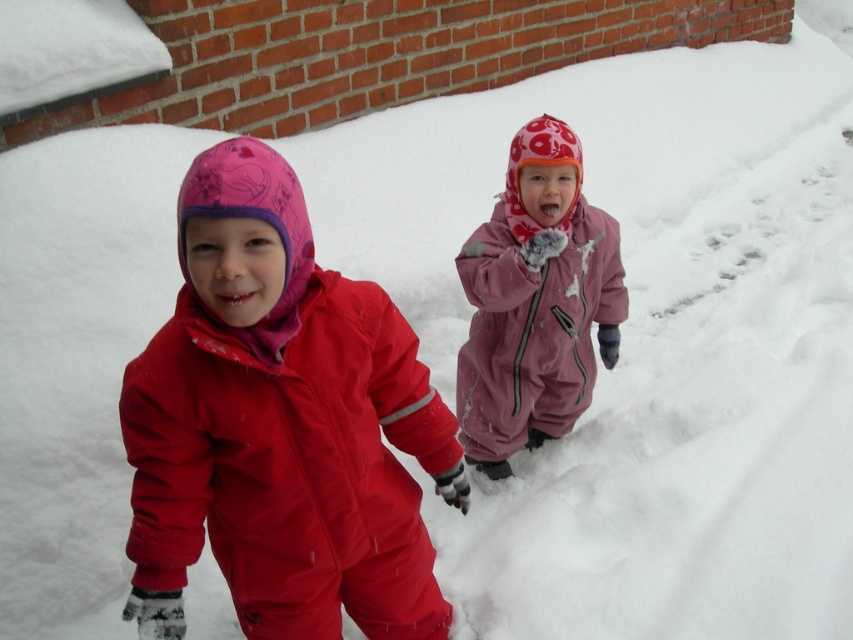
You are a photographer trying to capture both children in a single frame. Given that the matte red snowsuit at left and the matte pink snowsuit at center are visible, which child should you position closer to the center of the frame to ensure both fit comfortably without overcrowding?

The matte red snowsuit at left is wider than the matte pink snowsuit at center. To ensure both fit comfortably, position the wider matte red snowsuit at left closer to the center of the frame, as its greater width requires more space.

You are a photographer standing 1.5 meters away from the two children. You want to capture a photo where both the matte red snowsuit at left and the matte pink snowsuit at center are in focus. Given that your camera can focus on objects within a 1 meter range, will both children be in focus?

The matte red snowsuit at left is 89.33 centimeters from the matte pink snowsuit at center. Since the distance between them is less than 1 meter, both children will be within the camera focus range and thus in focus.